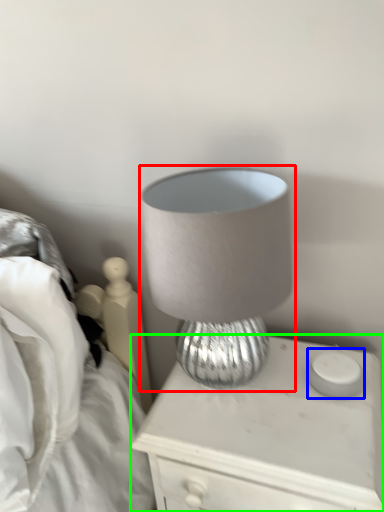
Question: Which object is the farthest from lamp (highlighted by a red box)? Choose among these: candle holder (highlighted by a blue box) or nightstand (highlighted by a green box).

Choices:
 (A) candle holder
 (B) nightstand

Answer: (A)